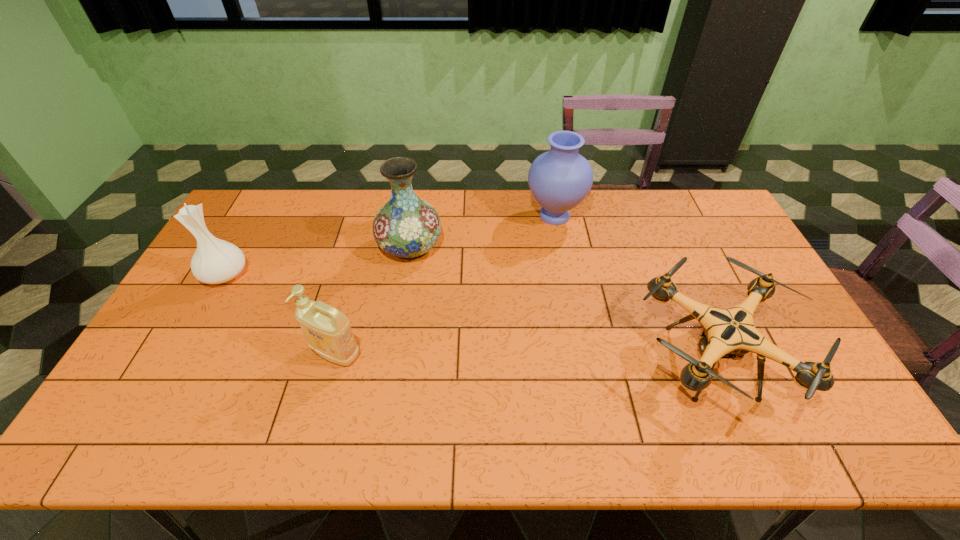
This screenshot has height=540, width=960. Identify the location of the second vase from left to right. (407, 227).

Image resolution: width=960 pixels, height=540 pixels. In order to click on the fourth object from left to right in this screenshot , I will do `click(559, 179)`.

Find the location of `the leftmost vase`. the leftmost vase is located at coordinates (215, 261).

This screenshot has height=540, width=960. Find the location of `the leftmost object`. the leftmost object is located at coordinates (215, 261).

Locate an element on the screen. Image resolution: width=960 pixels, height=540 pixels. detergent is located at coordinates (328, 332).

Find the location of a particular element. This screenshot has width=960, height=540. the shortest object is located at coordinates (727, 333).

Image resolution: width=960 pixels, height=540 pixels. I want to click on drone, so (727, 333).

Where is `free space located 0.100m on the front of the second vase from left to right`? The height and width of the screenshot is (540, 960). free space located 0.100m on the front of the second vase from left to right is located at coordinates (402, 293).

Where is `vacant space located on the right of the fourth object from left to right`? vacant space located on the right of the fourth object from left to right is located at coordinates (615, 216).

At what (x,y) coordinates should I click in order to perform the action: click on vacant region located on the right of the shortest vase. Please return your answer as a coordinate pair (x, y). The image size is (960, 540). Looking at the image, I should click on (303, 274).